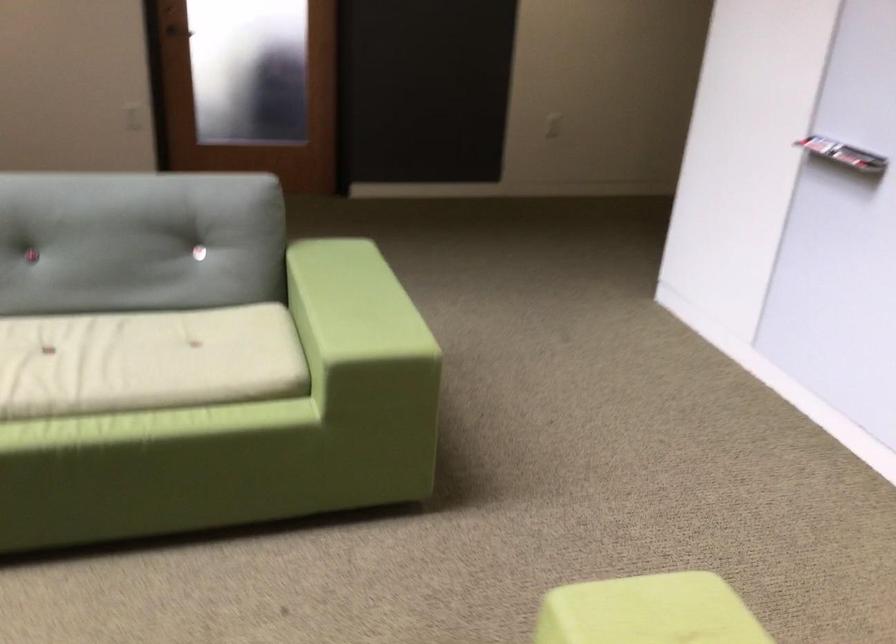
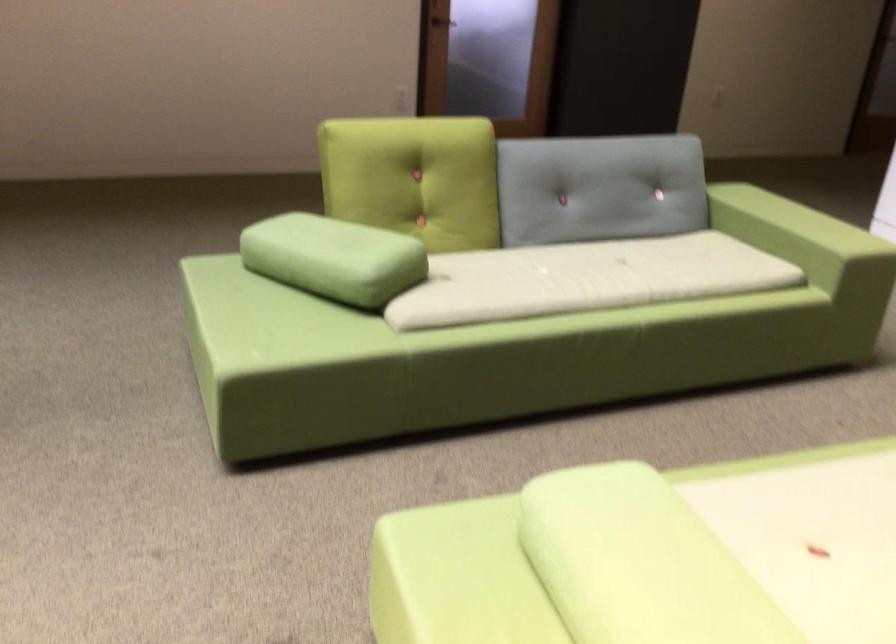
Find the pixel in the second image that matches point 92,242 in the first image.

(599, 187)